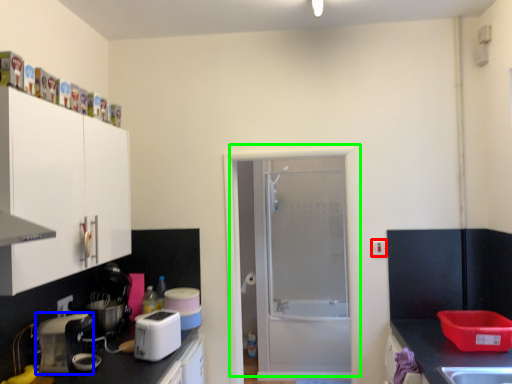
Question: Estimate the real-world distances between objects in this image. Which object is farther from electric outlet (highlighted by a red box), kitchen appliance (highlighted by a blue box) or door (highlighted by a green box)?

Choices:
 (A) kitchen appliance
 (B) door

Answer: (A)